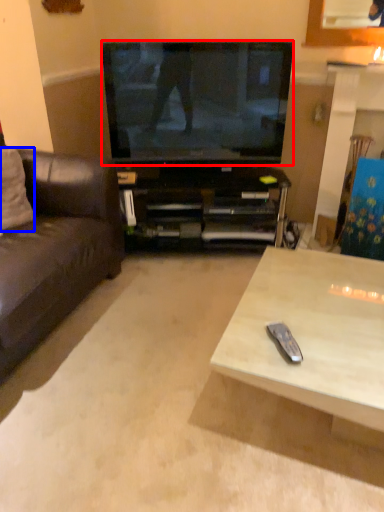
Question: Among these objects, which one is nearest to the camera, television (highlighted by a red box) or pillow (highlighted by a blue box)?

Choices:
 (A) television
 (B) pillow

Answer: (B)